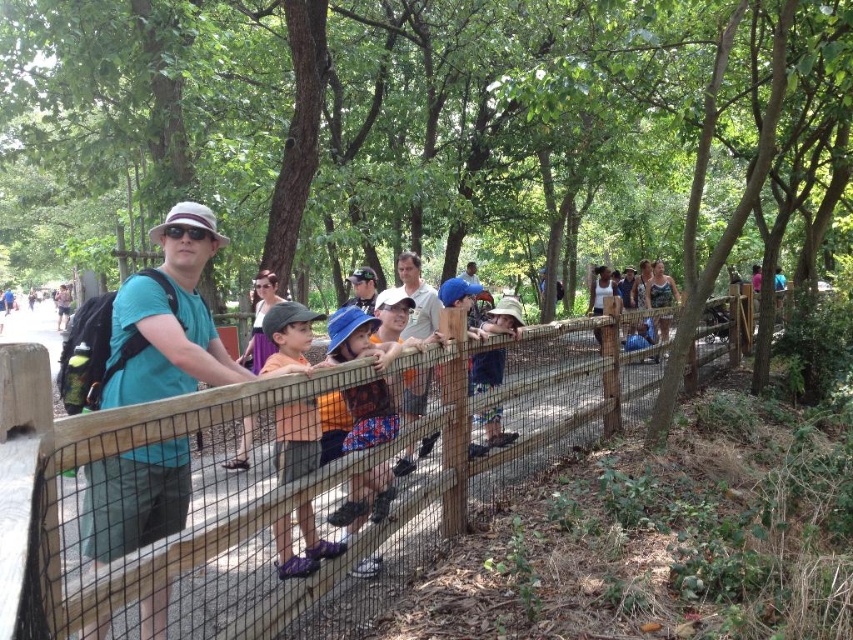
Question: Which point is closer to the camera?

Choices:
 (A) purple satin dress at center
 (B) orange fabric shirt at center
 (C) wooden fence at center

Answer: (C)

Question: Based on their relative distances, which object is farther from the wooden fence at center?

Choices:
 (A) orange fabric shirt at center
 (B) purple satin dress at center

Answer: (B)

Question: Can you confirm if wooden fence at center is wider than purple satin dress at center?

Choices:
 (A) no
 (B) yes

Answer: (A)

Question: Which point appears farthest from the camera in this image?

Choices:
 (A) (242, 532)
 (B) (283, 561)
 (C) (259, 332)

Answer: (C)

Question: Is wooden fence at center to the right of blue denim shorts at center from the viewer's perspective?

Choices:
 (A) yes
 (B) no

Answer: (B)

Question: Is wooden fence at center further to camera compared to purple satin dress at center?

Choices:
 (A) no
 (B) yes

Answer: (A)